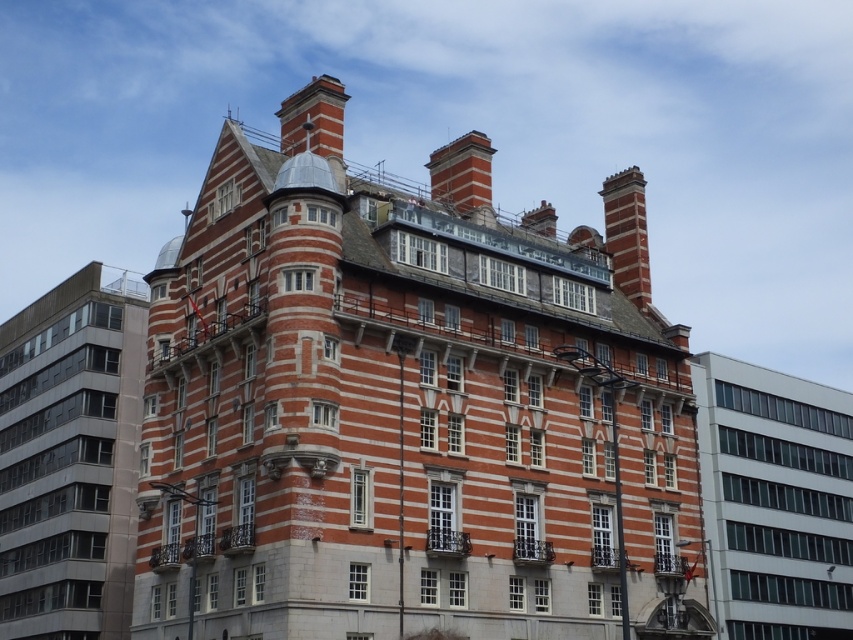
You are a city planner trying to assess the width of the red brick building at center and the red brick chimney at upper right. Based on the image, can you determine which one is wider?

The red brick building at center might be wider than red brick chimney at upper right according to the description.

You are an architect examining the building from the street. You notice two chimneys on the roof. Which chimney, the red brick chimney at upper right or the red brick chimney at upper center, is closer to you?

The red brick chimney at upper right is closer to you because it is in front of the red brick chimney at upper center.

You are an urban planner reviewing a city map and notice the red brick building at center and the red brick chimney at upper right. Which of these two structures takes up more area on the map?

The red brick chimney at upper right occupies more space than the red brick building at center according to the description provided.